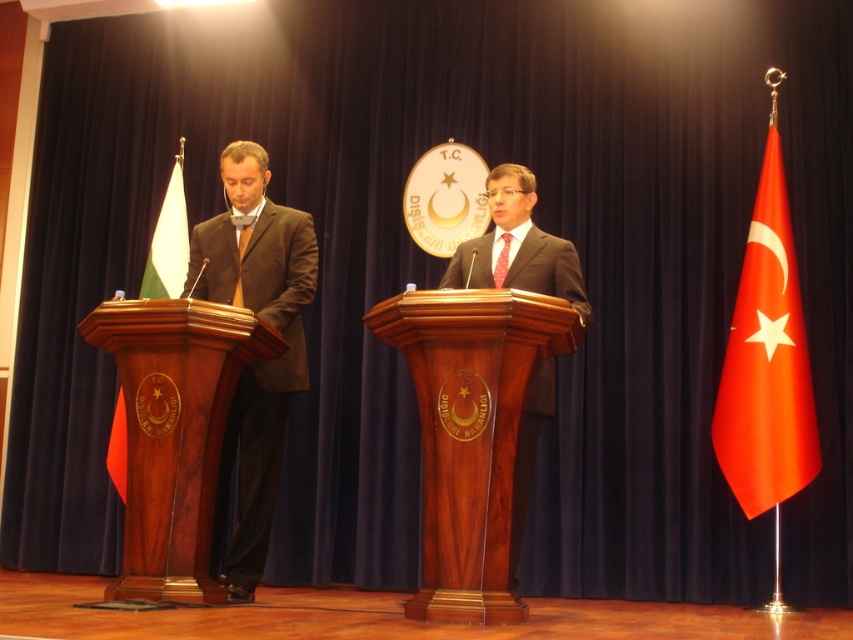
Question: Does wooden podium at center appear on the left side of matte brown suit at left?

Choices:
 (A) no
 (B) yes

Answer: (A)

Question: Among these points, which one is farthest from the camera?

Choices:
 (A) click(x=474, y=337)
 (B) click(x=241, y=216)

Answer: (B)

Question: Which of the following is the closest to the observer?

Choices:
 (A) (537, 333)
 (B) (173, 314)
 (C) (279, 396)
 (D) (740, 337)

Answer: (A)

Question: Is the position of matte brown suit at left less distant than that of red fabric flag at right?

Choices:
 (A) no
 (B) yes

Answer: (B)

Question: Estimate the real-world distances between objects in this image. Which object is farther from the wooden podium at center?

Choices:
 (A) wooden podium at left
 (B) red fabric flag at right

Answer: (B)

Question: Can you confirm if red fabric flag at right is wider than white fabric flag at left?

Choices:
 (A) no
 (B) yes

Answer: (B)